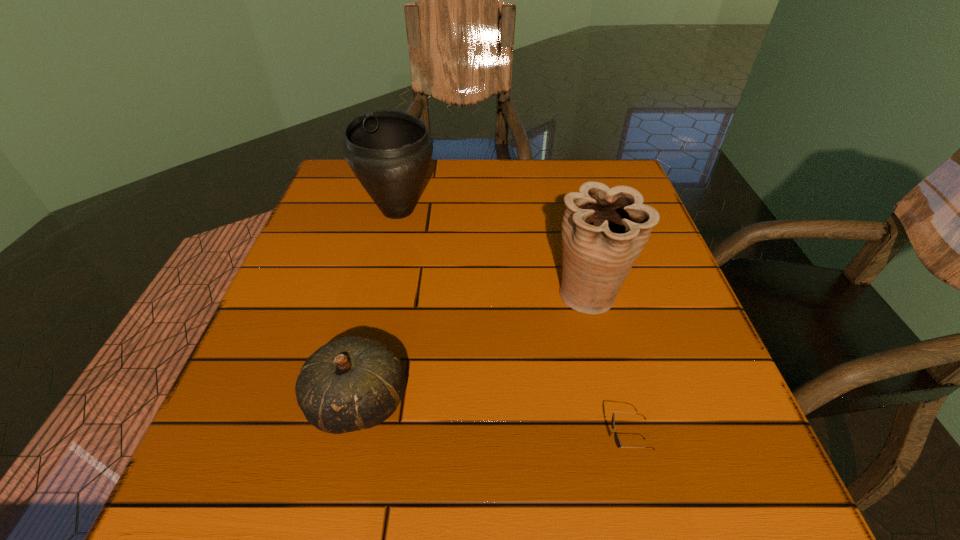
Identify the location of free point located 0.290m in front of the lenses of the shortest object. (413, 445).

Find the location of a particular element. This screenshot has width=960, height=540. vacant point located in front of the lenses of the shortest object is located at coordinates (573, 445).

This screenshot has width=960, height=540. I want to click on object located at the far edge, so (x=389, y=151).

Where is `object that is positioned at the near edge`? This screenshot has height=540, width=960. object that is positioned at the near edge is located at coordinates (618, 443).

Identify the location of urn that is at the left edge. This screenshot has width=960, height=540. (389, 151).

At what (x,y) coordinates should I click in order to perform the action: click on gourd located at the left edge. Please return your answer as a coordinate pair (x, y). Image resolution: width=960 pixels, height=540 pixels. Looking at the image, I should click on (352, 383).

At what (x,y) coordinates should I click in order to perform the action: click on urn that is at the right edge. Please return your answer as a coordinate pair (x, y). This screenshot has height=540, width=960. Looking at the image, I should click on (604, 230).

In order to click on sunglasses that is positioned at the right edge in this screenshot , I will do `click(618, 443)`.

Find the location of `object situated at the far left corner`. object situated at the far left corner is located at coordinates (389, 151).

Where is `object at the near right corner`? object at the near right corner is located at coordinates [618, 443].